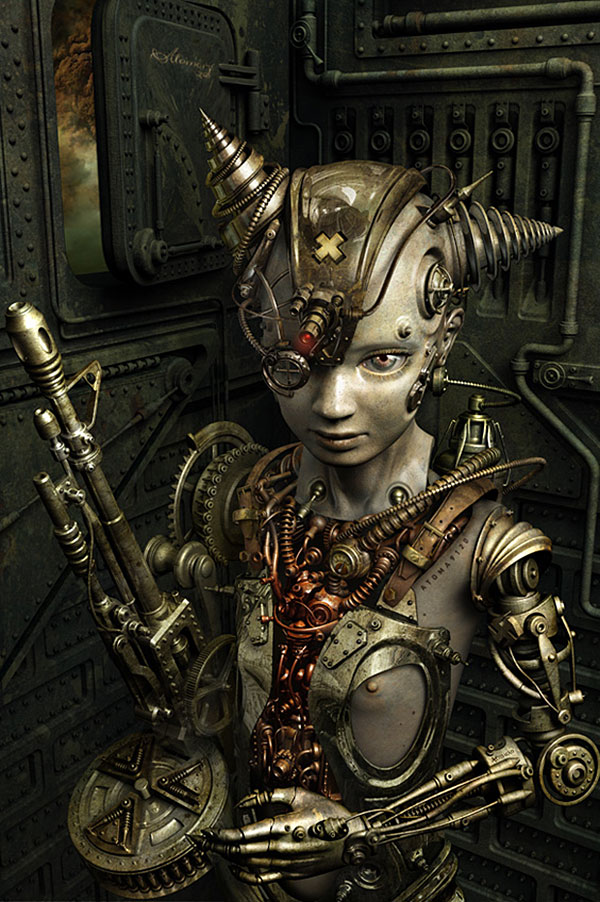
Image resolution: width=600 pixels, height=902 pixels. I want to click on glass, so click(286, 376).